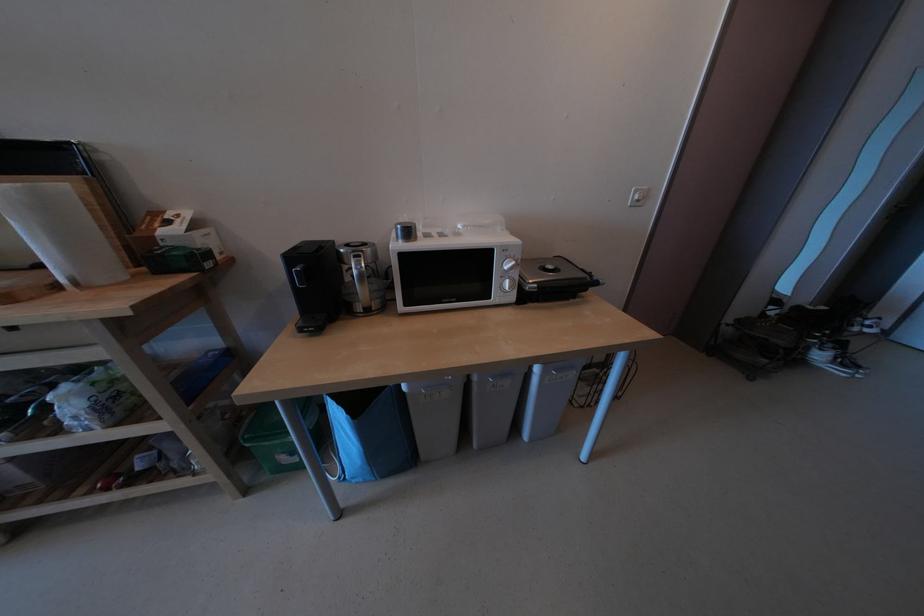
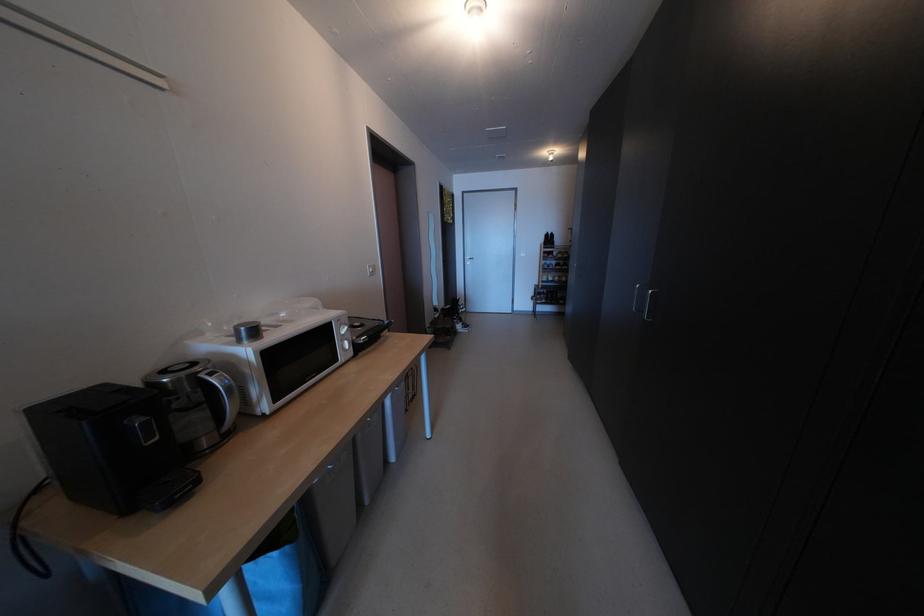
Question: The camera is either moving clockwise (left) or counter-clockwise (right) around the object. The first image is from the beginning of the video and the second image is from the end. Is the camera moving left or right when shooting the video?

Choices:
 (A) Left
 (B) Right

Answer: (A)